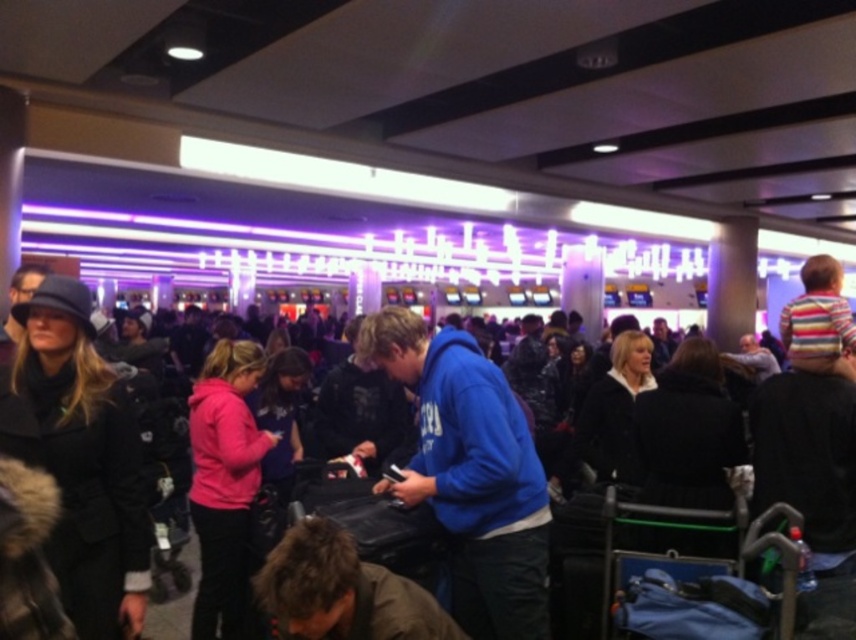
Question: Considering the real-world distances, which object is closest to the black fuzzy coat at center?

Choices:
 (A) black wool coat at left
 (B) pink fleece jacket at center

Answer: (B)

Question: Based on their relative distances, which object is nearer to the black wool coat at left?

Choices:
 (A) pink fleece jacket at center
 (B) black fuzzy coat at center

Answer: (A)

Question: In this image, where is black wool coat at left located relative to pink fleece jacket at center?

Choices:
 (A) right
 (B) left

Answer: (B)

Question: Can you confirm if black wool coat at left is positioned to the left of pink fleece jacket at center?

Choices:
 (A) yes
 (B) no

Answer: (A)

Question: Can you confirm if pink fleece jacket at center is positioned to the right of black fuzzy coat at center?

Choices:
 (A) no
 (B) yes

Answer: (A)

Question: Estimate the real-world distances between objects in this image. Which object is farther from the black wool coat at left?

Choices:
 (A) pink fleece jacket at center
 (B) black fuzzy coat at center

Answer: (B)